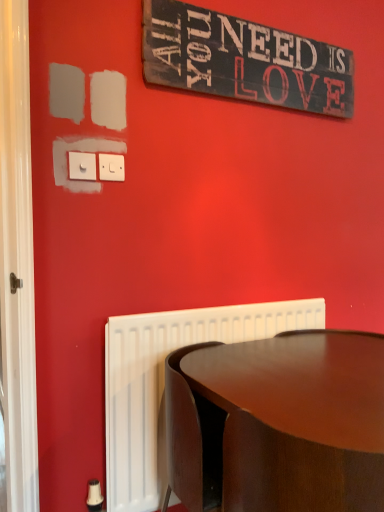
Question: From a real-world perspective, is glossy wood table at lower right positioned under white plastic switch at upper left, the first electric outlet when ordered from right to left, based on gravity?

Choices:
 (A) yes
 (B) no

Answer: (A)

Question: From a real-world perspective, is glossy wood table at lower right physically above white plastic switch at upper left, the first electric outlet when ordered from right to left?

Choices:
 (A) yes
 (B) no

Answer: (B)

Question: Does glossy wood table at lower right have a lesser width compared to white plastic switch at upper left, the first electric outlet when ordered from right to left?

Choices:
 (A) no
 (B) yes

Answer: (A)

Question: Is glossy wood table at lower right not within white plastic switch at upper left, which is counted as the 1th electric outlet, starting from the back?

Choices:
 (A) yes
 (B) no

Answer: (A)

Question: From the image's perspective, does glossy wood table at lower right appear lower than white plastic switch at upper left, which is counted as the 1th electric outlet, starting from the back?

Choices:
 (A) no
 (B) yes

Answer: (B)

Question: From a real-world perspective, is glossy wood table at lower right physically located above or below white plastic switch at upper left, acting as the 2th electric outlet starting from the back?

Choices:
 (A) above
 (B) below

Answer: (B)

Question: Which is correct: glossy wood table at lower right is inside white plastic switch at upper left, acting as the 2th electric outlet starting from the back, or outside of it?

Choices:
 (A) outside
 (B) inside

Answer: (A)

Question: Considering the positions of glossy wood table at lower right and white plastic switch at upper left, arranged as the first electric outlet when viewed from the front, in the image, is glossy wood table at lower right taller or shorter than white plastic switch at upper left, arranged as the first electric outlet when viewed from the front,?

Choices:
 (A) tall
 (B) short

Answer: (A)

Question: From the image's perspective, is glossy wood table at lower right positioned above or below white plastic switch at upper left, acting as the 2th electric outlet starting from the back?

Choices:
 (A) below
 (B) above

Answer: (A)

Question: Considering the positions of point (119, 168) and point (243, 31), is point (119, 168) closer or farther from the camera than point (243, 31)?

Choices:
 (A) closer
 (B) farther

Answer: (A)

Question: Looking at their shapes, would you say white plastic switch at upper left, placed as the second electric outlet when sorted from left to right, is wider or thinner than rustic wood signboard at upper center?

Choices:
 (A) wide
 (B) thin

Answer: (B)

Question: Considering their positions, is white plastic switch at upper left, the second electric outlet when ordered from front to back, located in front of or behind rustic wood signboard at upper center?

Choices:
 (A) front
 (B) behind

Answer: (A)

Question: Is white plastic switch at upper left, the second electric outlet when ordered from front to back, inside the boundaries of rustic wood signboard at upper center, or outside?

Choices:
 (A) inside
 (B) outside

Answer: (B)

Question: From a real-world perspective, relative to white plastic switch at upper left, which is counted as the 1th electric outlet, starting from the back, is white glossy door at left vertically above or below?

Choices:
 (A) below
 (B) above

Answer: (A)

Question: Is white glossy door at left inside or outside of white plastic switch at upper left, which is counted as the 1th electric outlet, starting from the back?

Choices:
 (A) outside
 (B) inside

Answer: (A)